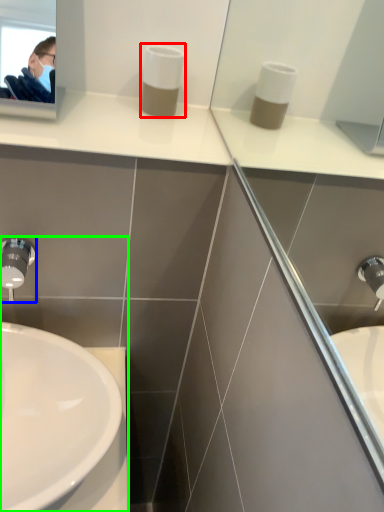
Question: Which object is the closest to the soap dispenser (highlighted by a red box)? Choose among these: tap (highlighted by a blue box) or sink (highlighted by a green box).

Choices:
 (A) tap
 (B) sink

Answer: (A)